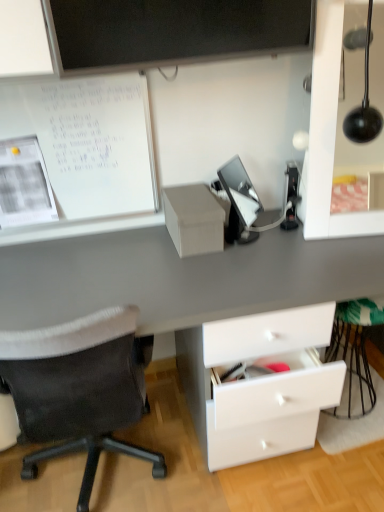
Identify the location of vacant area that is in front of matte black lamp at upper right. (347, 257).